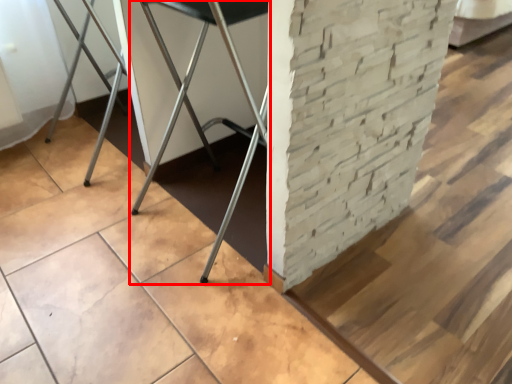
Question: From the image's perspective, what is the correct spatial positioning of furniture (annotated by the red box) in reference to concrete?

Choices:
 (A) below
 (B) above

Answer: (A)